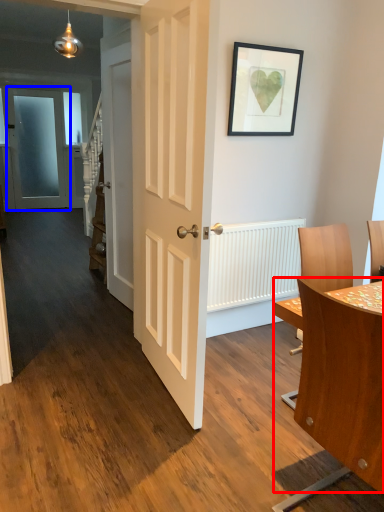
Question: Which point is further to the camera, table (highlighted by a red box) or door (highlighted by a blue box)?

Choices:
 (A) table
 (B) door

Answer: (B)